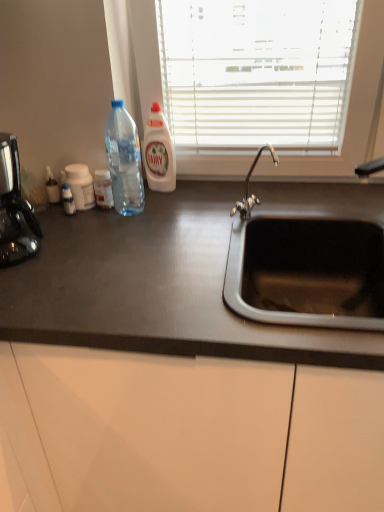
Question: Is transparent plastic bottle at left, the 1th bottle viewed from the right, beside black matte countertop at center?

Choices:
 (A) no
 (B) yes

Answer: (A)

Question: From a real-world perspective, is transparent plastic bottle at left, the 1th bottle viewed from the right, positioned under black matte countertop at center based on gravity?

Choices:
 (A) yes
 (B) no

Answer: (B)

Question: Is transparent plastic bottle at left, the 1th bottle viewed from the right, outside black matte countertop at center?

Choices:
 (A) yes
 (B) no

Answer: (A)

Question: Considering the relative sizes of transparent plastic bottle at left, the 1th bottle viewed from the right, and black matte countertop at center in the image provided, is transparent plastic bottle at left, the 1th bottle viewed from the right, wider than black matte countertop at center?

Choices:
 (A) no
 (B) yes

Answer: (A)

Question: Are transparent plastic bottle at left, the 1th bottle viewed from the right, and black matte countertop at center located far from each other?

Choices:
 (A) yes
 (B) no

Answer: (B)

Question: Is black matte countertop at center at the back of transparent plastic bottle at left, the 3th bottle viewed from the left?

Choices:
 (A) yes
 (B) no

Answer: (B)

Question: From the image's perspective, does satin black coffee machine at left appear higher than white plastic bottle at center?

Choices:
 (A) no
 (B) yes

Answer: (A)

Question: Is satin black coffee machine at left looking in the opposite direction of white plastic bottle at center?

Choices:
 (A) yes
 (B) no

Answer: (B)

Question: Would you say satin black coffee machine at left is outside white plastic bottle at center?

Choices:
 (A) yes
 (B) no

Answer: (A)

Question: Can you confirm if satin black coffee machine at left is positioned to the left of white plastic bottle at center?

Choices:
 (A) no
 (B) yes

Answer: (B)

Question: Would you say satin black coffee machine at left is a long distance from white plastic bottle at center?

Choices:
 (A) yes
 (B) no

Answer: (B)

Question: Does satin black coffee machine at left come in front of white plastic bottle at center?

Choices:
 (A) no
 (B) yes

Answer: (B)

Question: Considering the relative positions of black matte countertop at center and white plastic bottle at center in the image provided, is black matte countertop at center in front of white plastic bottle at center?

Choices:
 (A) yes
 (B) no

Answer: (A)